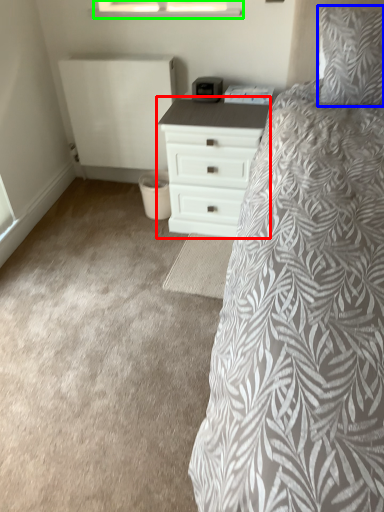
Question: Which is farther away from chest of drawers (highlighted by a red box)? pillow (highlighted by a blue box) or window (highlighted by a green box)?

Choices:
 (A) pillow
 (B) window

Answer: (B)